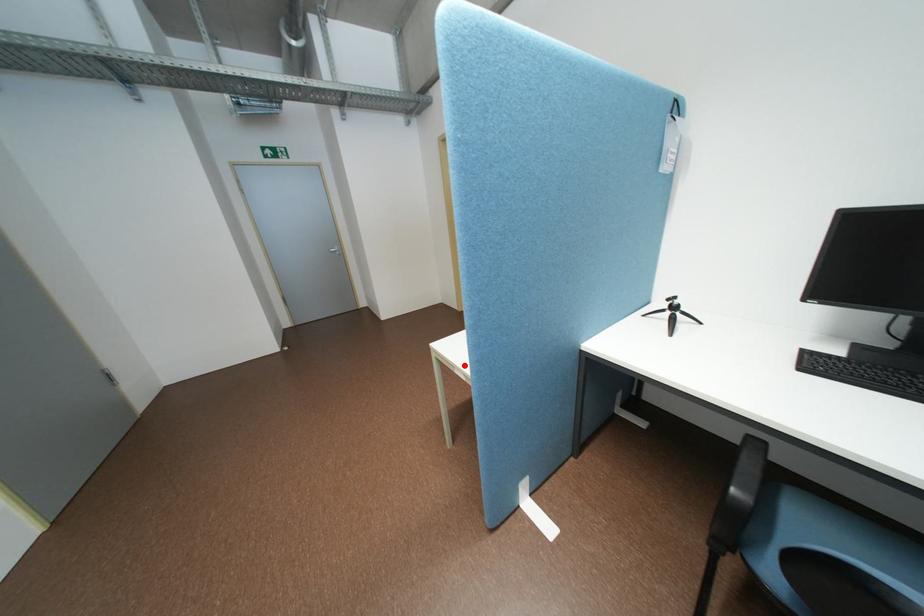
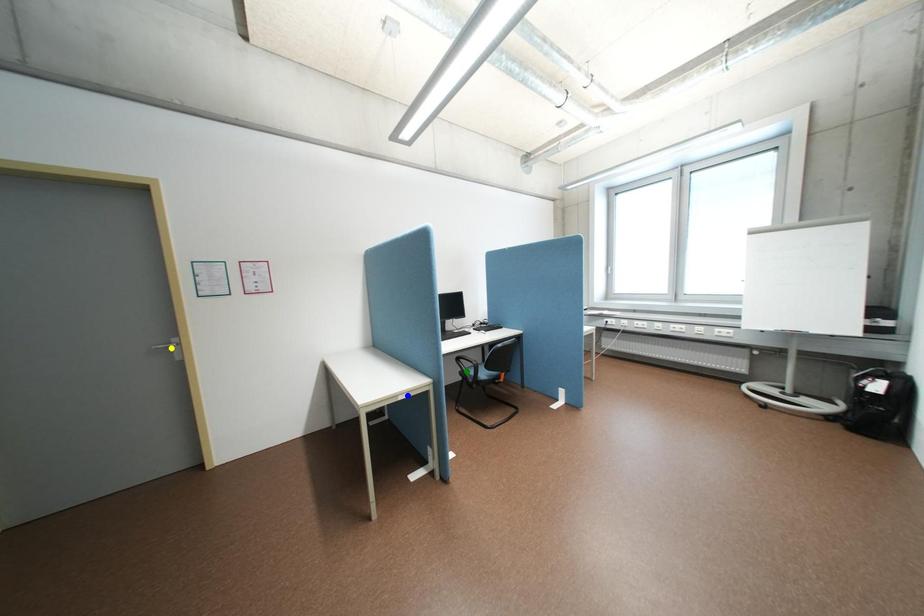
Question: I am providing you with two images of the same scene from different viewpoints. A red point is marked on the first image. You are given multiple points on the second image. Which point in image 2 represents the same 3d spot as the red point in image 1?

Choices:
 (A) green point
 (B) yellow point
 (C) blue point

Answer: (C)